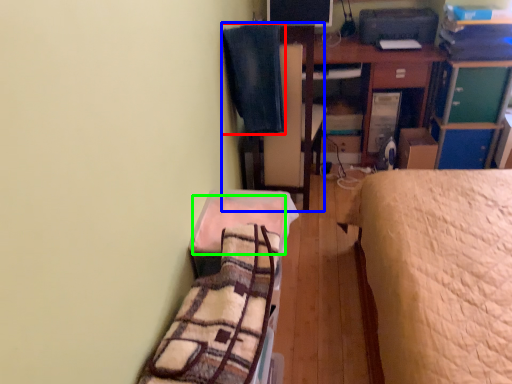
Question: Which is farther away from blanket (highlighted by a red box)? swivel chair (highlighted by a blue box) or blanket (highlighted by a green box)?

Choices:
 (A) swivel chair
 (B) blanket

Answer: (B)